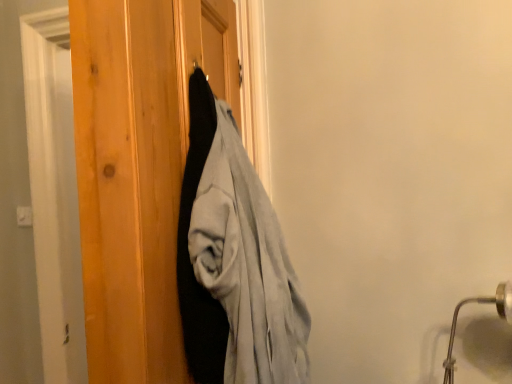
Question: In the image, is matte black coat at center on the left side or the right side of silver metallic door handle at lower right?

Choices:
 (A) left
 (B) right

Answer: (A)

Question: Considering their positions, is matte black coat at center located in front of or behind silver metallic door handle at lower right?

Choices:
 (A) behind
 (B) front

Answer: (B)

Question: Based on their sizes in the image, would you say matte black coat at center is bigger or smaller than silver metallic door handle at lower right?

Choices:
 (A) big
 (B) small

Answer: (A)

Question: From a real-world perspective, is silver metallic door handle at lower right above or below matte black coat at center?

Choices:
 (A) above
 (B) below

Answer: (B)

Question: Is silver metallic door handle at lower right in front of or behind matte black coat at center in the image?

Choices:
 (A) behind
 (B) front

Answer: (A)

Question: From the image's perspective, is silver metallic door handle at lower right positioned above or below matte black coat at center?

Choices:
 (A) above
 (B) below

Answer: (B)

Question: Looking at the image, does silver metallic door handle at lower right seem bigger or smaller compared to matte black coat at center?

Choices:
 (A) big
 (B) small

Answer: (B)